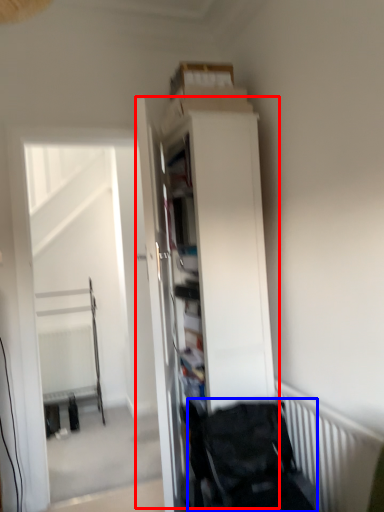
Question: Which object appears farthest to the camera in this image, dresser (highlighted by a red box) or baby carriage (highlighted by a blue box)?

Choices:
 (A) dresser
 (B) baby carriage

Answer: (A)